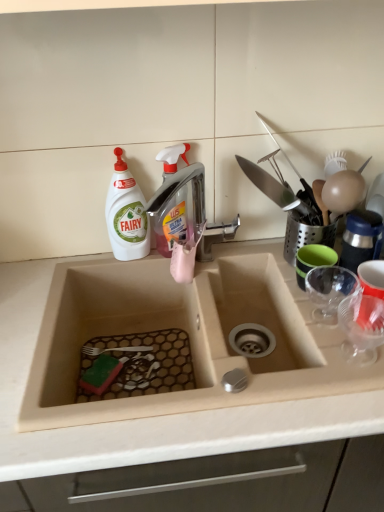
You are a GUI agent. You are given a task and a screenshot of the screen. Output one action in this format:
    pyautogui.click(x=<x>, y=<y>)
    Task: Click on the vacant position to the left of white matte bottle at upper left, the 1th cleaning product from the left
    The height and width of the screenshot is (512, 384).
    Given the screenshot: What is the action you would take?
    pyautogui.click(x=80, y=266)